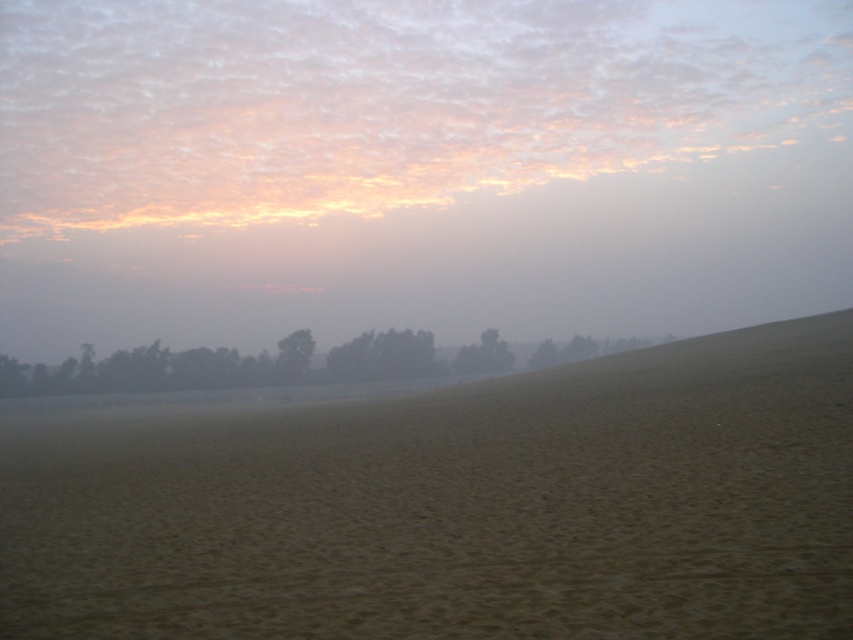
Does brown sandy dirt field at center come behind dark green trees at lower center?

That is False.

Who is positioned more to the left, brown sandy dirt field at center or dark green trees at lower center?

dark green trees at lower center

Does point (756, 380) come in front of point (99, 371)?

Yes, point (756, 380) is in front of point (99, 371).

The height and width of the screenshot is (640, 853). Find the location of `brown sandy dirt field at center`. brown sandy dirt field at center is located at coordinates (456, 506).

How distant is foggy sand at lower center from green matte tree at center?

foggy sand at lower center and green matte tree at center are 22.90 meters apart.

Does foggy sand at lower center have a greater width compared to green matte tree at center?

Correct, the width of foggy sand at lower center exceeds that of green matte tree at center.

Locate an element on the screen. Image resolution: width=853 pixels, height=640 pixels. foggy sand at lower center is located at coordinates (418, 168).

Identify the location of foggy sand at lower center. The height and width of the screenshot is (640, 853). (418, 168).

Who is shorter, foggy sand at lower center or dark green trees at lower center?

With less height is dark green trees at lower center.

Is foggy sand at lower center further to the viewer compared to dark green trees at lower center?

That is True.

Which is behind, point (572, 128) or point (404, 332)?

Positioned behind is point (572, 128).

Where is `foggy sand at lower center`? foggy sand at lower center is located at coordinates (418, 168).